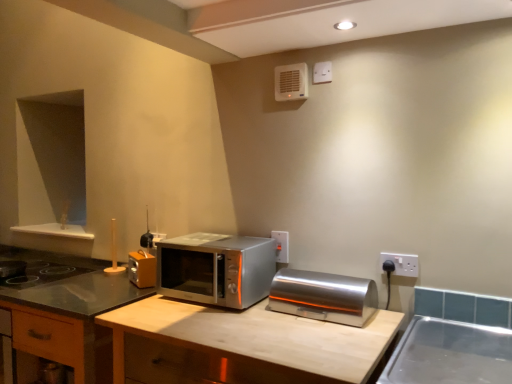
Question: From a real-world perspective, is satin silver microwave at center physically located above or below wooden cabinet at center?

Choices:
 (A) above
 (B) below

Answer: (A)

Question: From the image's perspective, is satin silver microwave at center above or below wooden cabinet at center?

Choices:
 (A) below
 (B) above

Answer: (B)

Question: Estimate the real-world distances between objects in this image. Which object is farther from the satin silver microwave at center?

Choices:
 (A) wooden at center
 (B) white plastic electrical outlet at right, arranged as the second electric outlet when viewed from the left
 (C) wooden cabinet at center
 (D) white plastic electric outlet at center, which ranks as the 1th electric outlet in back-to-front order
 (E) satin silver toaster at center

Answer: (B)

Question: Estimate the real-world distances between objects in this image. Which object is farther from the wooden cabinet at center?

Choices:
 (A) wooden at center
 (B) white plastic electrical outlet at right, arranged as the second electric outlet when viewed from the left
 (C) white plastic electric outlet at center, marked as the 1th electric outlet in a left-to-right arrangement
 (D) satin silver toaster at center
 (E) white plastic air conditioner at upper center

Answer: (B)